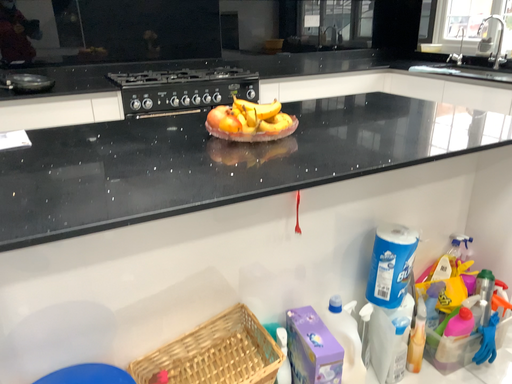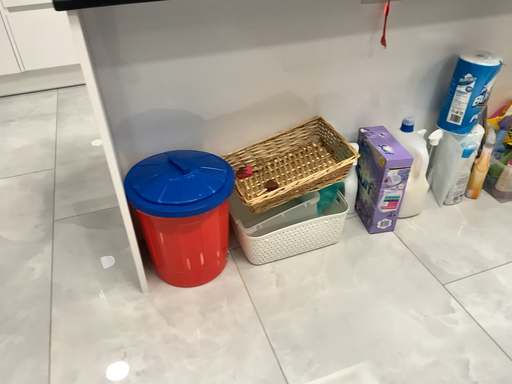
Question: How did the camera likely rotate when shooting the video?

Choices:
 (A) rotated left
 (B) rotated right

Answer: (A)